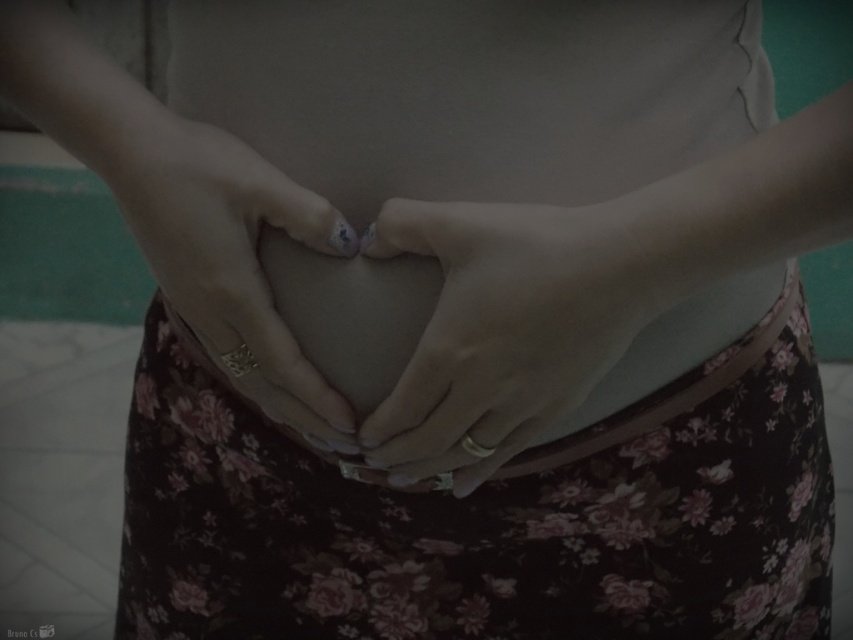
Can you confirm if floral fabric dress at center is positioned above matte gold ring at center?

No.

Who is shorter, floral fabric dress at center or matte gold ring at center?

matte gold ring at center is shorter.

This screenshot has width=853, height=640. What do you see at coordinates (486, 516) in the screenshot?
I see `floral fabric dress at center` at bounding box center [486, 516].

Where is `floral fabric dress at center`? This screenshot has height=640, width=853. floral fabric dress at center is located at coordinates (486, 516).

Which is behind, point (633, 605) or point (654, 253)?

The point (633, 605) is behind.

Who is lower down, floral fabric dress at center or smooth skin hand at center?

floral fabric dress at center is below.

The image size is (853, 640). What do you see at coordinates (486, 516) in the screenshot? I see `floral fabric dress at center` at bounding box center [486, 516].

Where is `floral fabric dress at center`? This screenshot has height=640, width=853. floral fabric dress at center is located at coordinates (486, 516).

Does smooth skin hand at center appear on the left side of matte gold ring at center?

No, smooth skin hand at center is not to the left of matte gold ring at center.

Which is behind, point (428, 390) or point (157, 228)?

Positioned behind is point (157, 228).

Locate an element on the screen. Image resolution: width=853 pixels, height=640 pixels. smooth skin hand at center is located at coordinates (508, 324).